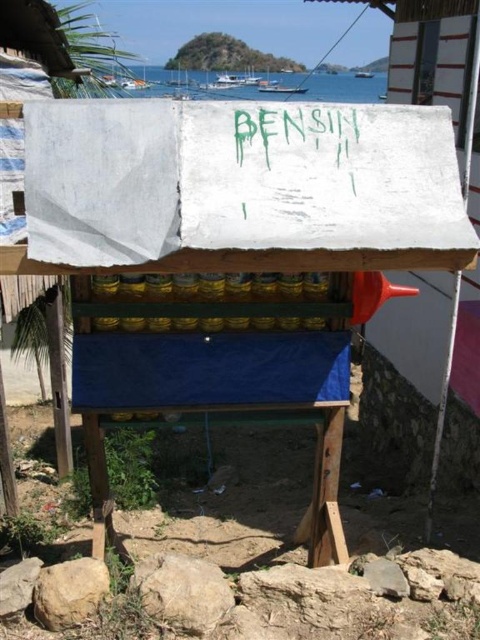
Question: Does green painted sign at center have a larger size compared to blue water at upper center?

Choices:
 (A) no
 (B) yes

Answer: (A)

Question: Is green painted sign at center closer to the viewer compared to blue water at upper center?

Choices:
 (A) no
 (B) yes

Answer: (B)

Question: Which point appears closest to the camera in this image?

Choices:
 (A) [x=292, y=170]
 (B) [x=128, y=96]

Answer: (A)

Question: Is green painted sign at center thinner than blue water at upper center?

Choices:
 (A) no
 (B) yes

Answer: (B)

Question: Among these points, which one is nearest to the camera?

Choices:
 (A) (259, 113)
 (B) (379, 84)

Answer: (A)